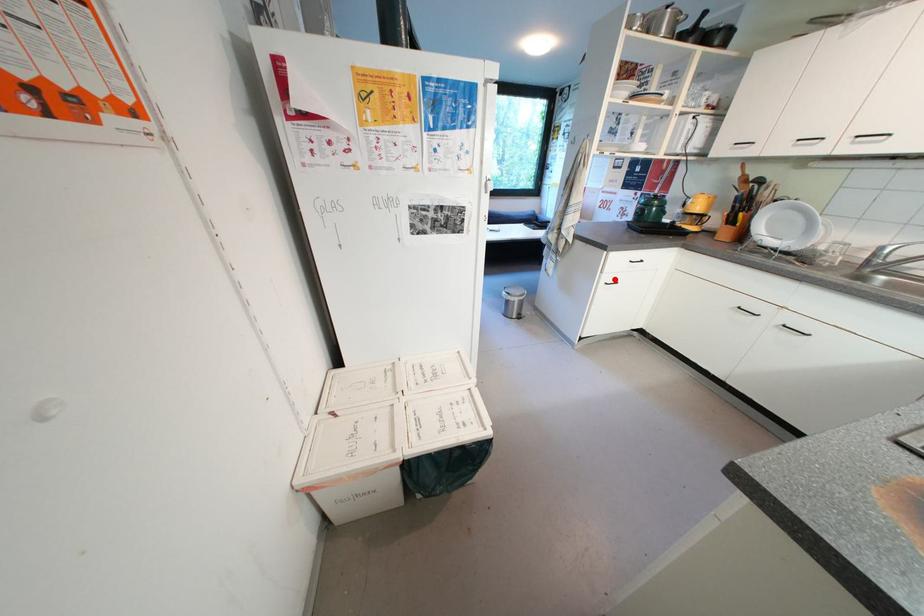
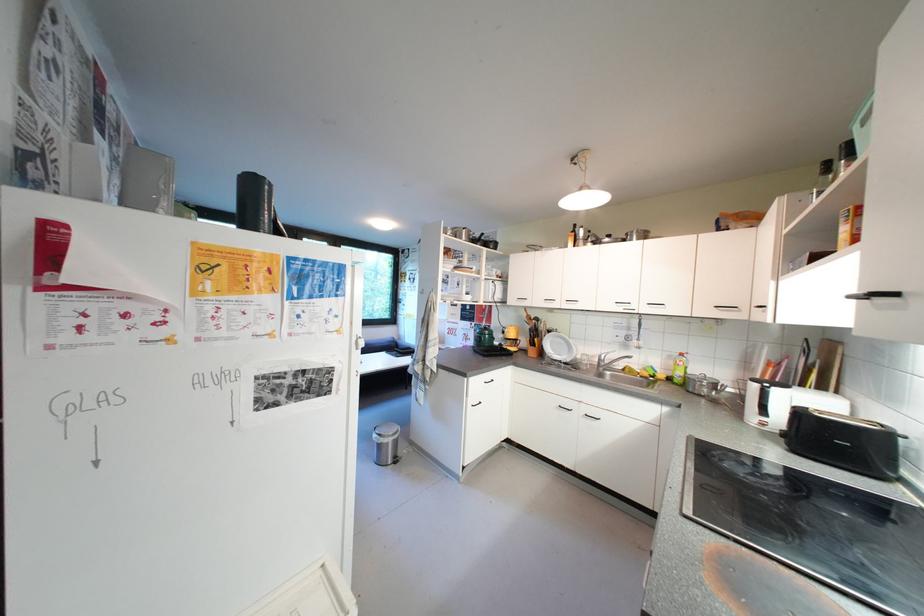
Where in the second image is the point corresponding to the highlighted location from the first image?

(480, 402)